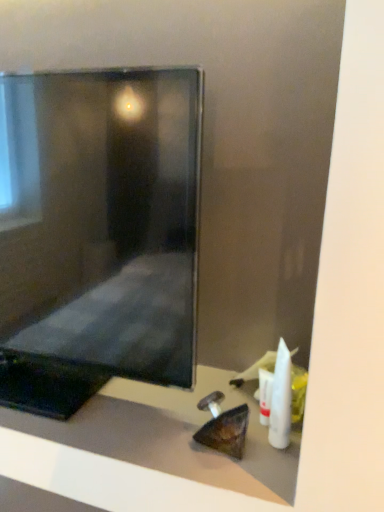
Locate an element on the screen. The height and width of the screenshot is (512, 384). vacant space underneath matte black monitor at center (from a real-world perspective) is located at coordinates (105, 411).